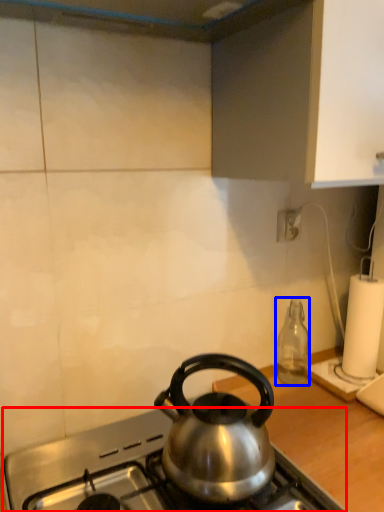
Question: Which object appears farthest to the camera in this image, gas stove (highlighted by a red box) or bottle (highlighted by a blue box)?

Choices:
 (A) gas stove
 (B) bottle

Answer: (B)